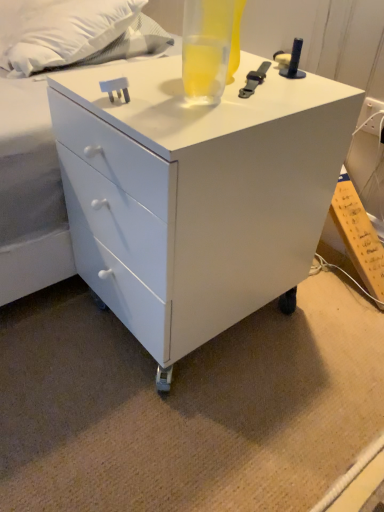
Question: Can you confirm if translucent glass beverage at top is positioned to the left of white glossy chest of drawers at center?

Choices:
 (A) yes
 (B) no

Answer: (B)

Question: Is translucent glass beverage at top facing towards white glossy chest of drawers at center?

Choices:
 (A) yes
 (B) no

Answer: (B)

Question: Is translucent glass beverage at top at the right side of white glossy chest of drawers at center?

Choices:
 (A) yes
 (B) no

Answer: (A)

Question: Is translucent glass beverage at top positioned beyond the bounds of white glossy chest of drawers at center?

Choices:
 (A) no
 (B) yes

Answer: (B)

Question: Can you confirm if translucent glass beverage at top is taller than white glossy chest of drawers at center?

Choices:
 (A) yes
 (B) no

Answer: (B)

Question: From a real-world perspective, is white glossy chest of drawers at center physically located above or below white soft pillow at upper left?

Choices:
 (A) below
 (B) above

Answer: (A)

Question: Relative to white soft pillow at upper left, is white glossy chest of drawers at center in front or behind?

Choices:
 (A) front
 (B) behind

Answer: (A)

Question: Considering the positions of point (168, 111) and point (16, 49), is point (168, 111) closer or farther from the camera than point (16, 49)?

Choices:
 (A) closer
 (B) farther

Answer: (A)

Question: From the image's perspective, is white glossy chest of drawers at center above or below white soft pillow at upper left?

Choices:
 (A) below
 (B) above

Answer: (A)

Question: Considering the relative positions of translucent glass beverage at top and white glossy chest of drawers at center in the image provided, is translucent glass beverage at top to the left or to the right of white glossy chest of drawers at center?

Choices:
 (A) left
 (B) right

Answer: (B)

Question: Considering the positions of translucent glass beverage at top and white glossy chest of drawers at center in the image, is translucent glass beverage at top wider or thinner than white glossy chest of drawers at center?

Choices:
 (A) wide
 (B) thin

Answer: (B)

Question: Do you think translucent glass beverage at top is within white glossy chest of drawers at center, or outside of it?

Choices:
 (A) outside
 (B) inside

Answer: (A)

Question: Based on their sizes in the image, would you say translucent glass beverage at top is bigger or smaller than white glossy chest of drawers at center?

Choices:
 (A) small
 (B) big

Answer: (A)

Question: Is white soft pillow at upper left in front of or behind translucent glass beverage at top in the image?

Choices:
 (A) front
 (B) behind

Answer: (B)

Question: Based on their sizes in the image, would you say white soft pillow at upper left is bigger or smaller than translucent glass beverage at top?

Choices:
 (A) big
 (B) small

Answer: (A)